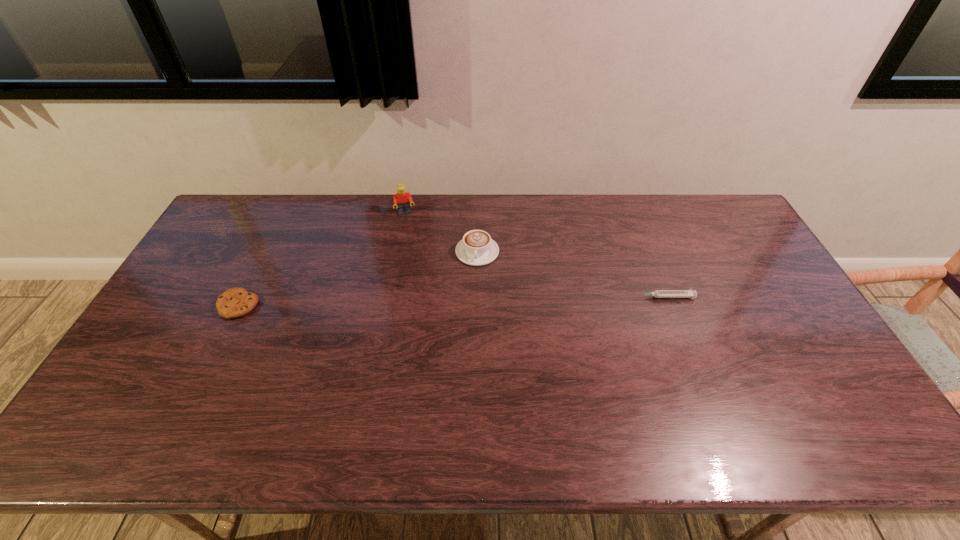
At what (x,y) coordinates should I click in order to perform the action: click on free spot at the near edge of the desktop. Please return your answer as a coordinate pair (x, y). The height and width of the screenshot is (540, 960). Looking at the image, I should click on (548, 389).

Identify the location of free spot between the second tallest object and the farthest object. (442, 233).

Locate an element on the screen. unoccupied area between the rightmost object and the leftmost object is located at coordinates (451, 301).

The image size is (960, 540). What are the coordinates of `free point between the tallest object and the cookie` in the screenshot? It's located at (322, 260).

You are a GUI agent. You are given a task and a screenshot of the screen. Output one action in this format:
    pyautogui.click(x=<x>, y=<y>)
    Task: Click on the free space between the second farthest object and the rightmost object
    
    Given the screenshot: What is the action you would take?
    pyautogui.click(x=570, y=274)

The width and height of the screenshot is (960, 540). What are the coordinates of `vacant area that lies between the leftmost object and the cappuccino` in the screenshot? It's located at (358, 279).

Identify the location of free space between the tallest object and the shortest object. coord(535,255).

The height and width of the screenshot is (540, 960). I want to click on vacant space in between the second object from left to right and the rightmost object, so click(535, 255).

What are the coordinates of `free spot between the rightmost object and the cookie` in the screenshot? It's located at (451, 301).

Identify the location of blank region between the Lego and the syringe. This screenshot has height=540, width=960. (535, 255).